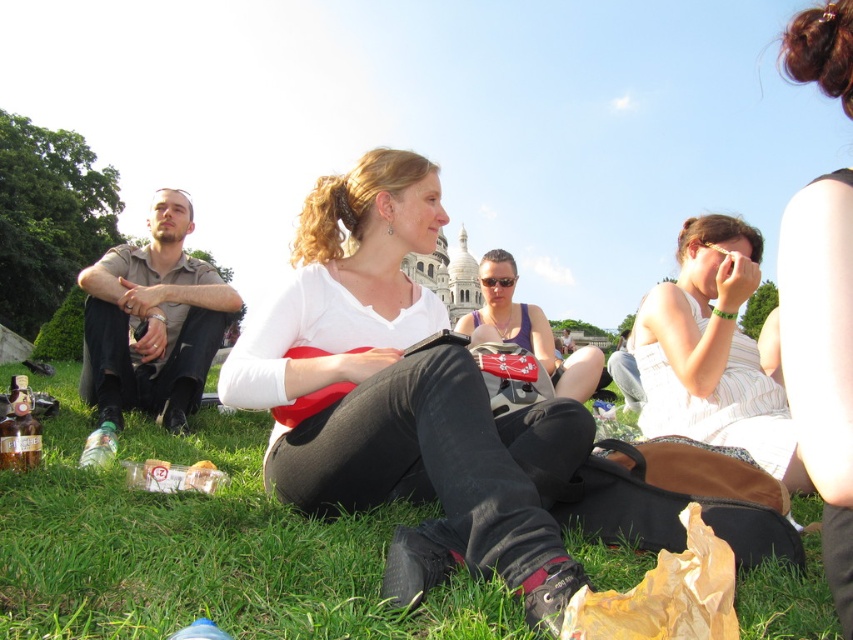
You are a photographer trying to capture a closeup of the matte purple tank top at center. Given that the green grass at lower center is in the way, can you determine if you need to move closer or farther away from the tank top to get it fully in frame?

The green grass at lower center has a larger size compared to matte purple tank top at center. To get a closeup of the matte purple tank top at center, you would need to move closer to it so that the larger green grass at lower center doesn

You are a photographer standing at the center of the scene. You need to adjust your camera to focus on the white matte shirt at center and the smooth brown hair at upper right. Which object should you focus on first if you want to capture both in one shot without changing the camera focus distance?

The white matte shirt at center has a lesser height compared to smooth brown hair at upper right, so you should focus on the smooth brown hair at upper right first since it is farther away and requires a greater depth of field to include both in the frame.